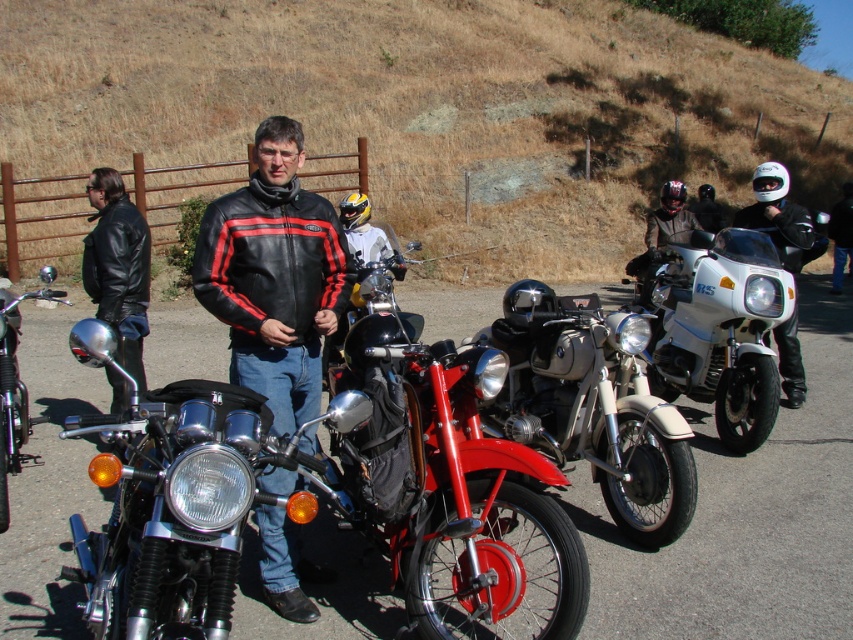
Does shiny chrome motorcycle at center have a lesser width compared to white matte helmet at upper right?

No, shiny chrome motorcycle at center is not thinner than white matte helmet at upper right.

Is point (688, 490) closer to viewer compared to point (840, 205)?

Yes, point (688, 490) is closer to viewer.

The width and height of the screenshot is (853, 640). What are the coordinates of `shiny chrome motorcycle at center` in the screenshot? It's located at (593, 404).

Does dry grass at upper center have a smaller size compared to white glossy motorcycle at center right?

Actually, dry grass at upper center might be larger than white glossy motorcycle at center right.

Who is more distant from viewer, (432, 250) or (689, 312)?

Positioned behind is point (432, 250).

At what (x,y) coordinates should I click in order to perform the action: click on dry grass at upper center. Please return your answer as a coordinate pair (x, y). Looking at the image, I should click on (430, 109).

Is black leather jacket at left wider than white matte helmet at center?

Indeed, black leather jacket at left has a greater width compared to white matte helmet at center.

Is black leather jacket at left shorter than white matte helmet at center?

No, black leather jacket at left is not shorter than white matte helmet at center.

Between point (140, 218) and point (780, 344), which one is positioned in front?

Point (140, 218) is more forward.

This screenshot has width=853, height=640. Identify the location of black leather jacket at left. (119, 266).